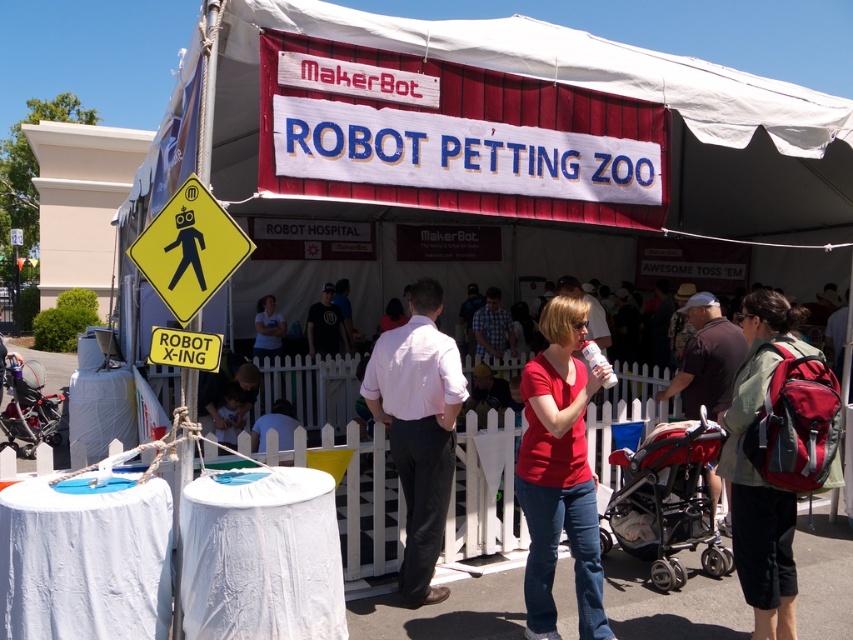
Question: Which is farther from the matte red shirt at center?

Choices:
 (A) dark blue shirt at center
 (B) white picket fence at center
 (C) black fabric shirt at center
 (D) yellow plastic pedestrian sign at left

Answer: (C)

Question: Can you confirm if black fabric shirt at center is positioned to the left of dark blue shirt at center?

Choices:
 (A) yes
 (B) no

Answer: (A)

Question: Does red backpack at lower right appear over white picket fence at center?

Choices:
 (A) no
 (B) yes

Answer: (B)

Question: Observing the image, what is the correct spatial positioning of pink cotton shirt at center in reference to yellow plastic pedestrian sign at left?

Choices:
 (A) right
 (B) left

Answer: (A)

Question: Among these points, which one is farthest from the camera?

Choices:
 (A) (712, 323)
 (B) (601, 433)
 (C) (328, 300)
 (D) (209, 408)

Answer: (C)

Question: Which object is the closest to the light blue t-shirt at center?

Choices:
 (A) dark brown leather jacket at center
 (B) yellow plastic pedestrian sign at left

Answer: (A)